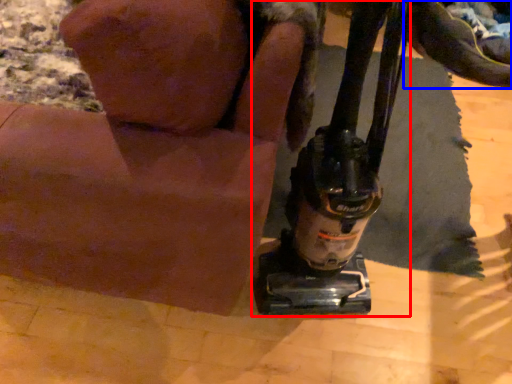
Question: Which object is further to the camera taking this photo, sewing machine (highlighted by a red box) or footwear (highlighted by a blue box)?

Choices:
 (A) sewing machine
 (B) footwear

Answer: (B)